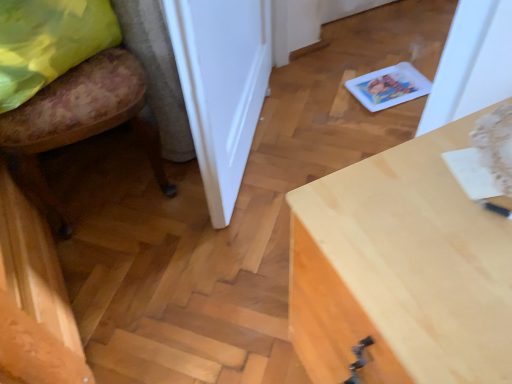
The height and width of the screenshot is (384, 512). In order to click on vacant area on top of light wood desk at center (from a real-world perspective) in this screenshot , I will do `click(442, 218)`.